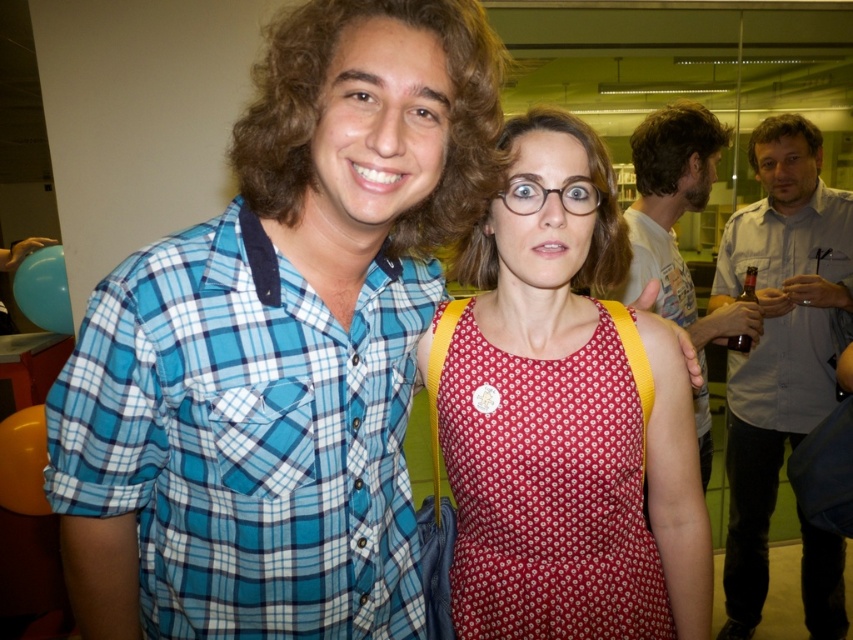
Question: Estimate the real-world distances between objects in this image. Which object is closer to the dotted fabric dress at center?

Choices:
 (A) clear plastic glasses at center
 (B) blue plaid shirt at left

Answer: (B)

Question: In this image, where is light blue plaid shirt at upper right located relative to matte white shirt at center?

Choices:
 (A) below
 (B) above

Answer: (A)

Question: From the image, what is the correct spatial relationship of matte white shirt at center in relation to clear plastic glasses at center?

Choices:
 (A) below
 (B) above

Answer: (A)

Question: Which object appears closest to the camera in this image?

Choices:
 (A) dotted fabric dress at center
 (B) blue plaid shirt at left
 (C) light blue plaid shirt at upper right

Answer: (B)

Question: Can you confirm if dotted fabric dress at center is wider than light blue plaid shirt at upper right?

Choices:
 (A) no
 (B) yes

Answer: (B)

Question: Which point appears closest to the camera in this image?

Choices:
 (A) (595, 196)
 (B) (738, 260)
 (C) (550, 380)
 (D) (651, 168)

Answer: (A)